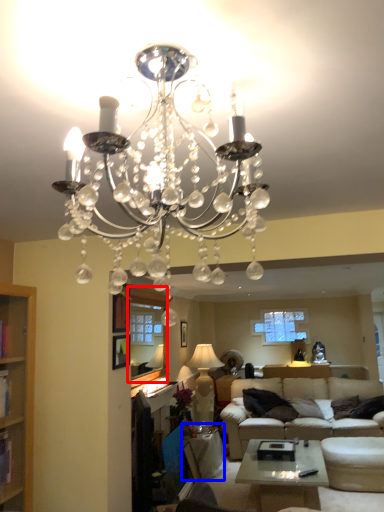
Question: Which object is closer to the camera taking this photo, window screen (highlighted by a red box) or side table (highlighted by a blue box)?

Choices:
 (A) window screen
 (B) side table

Answer: (A)